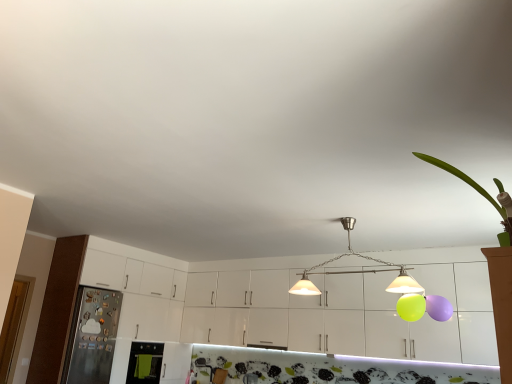
Question: Would you say green leafy plant at upper right is inside or outside green fabric oven at lower left, the 2th appliance from the left?

Choices:
 (A) inside
 (B) outside

Answer: (B)

Question: Considering the positions of green leafy plant at upper right and green fabric oven at lower left, the 1th appliance positioned from the right, in the image, is green leafy plant at upper right bigger or smaller than green fabric oven at lower left, the 1th appliance positioned from the right,?

Choices:
 (A) small
 (B) big

Answer: (B)

Question: Based on their relative distances, which object is nearer to the metallic pendant lights at center?

Choices:
 (A) green leafy plant at upper right
 (B) green fabric oven at lower left, the 1th appliance positioned from the right
 (C) metallic refrigerator at left, the 2th appliance viewed from the right
 (D) white glossy cabinets at center

Answer: (A)

Question: Considering the real-world distances, which object is closest to the metallic pendant lights at center?

Choices:
 (A) white glossy cabinets at center
 (B) metallic refrigerator at left, the 2th appliance viewed from the right
 (C) green leafy plant at upper right
 (D) green fabric oven at lower left, the 2th appliance from the left

Answer: (C)